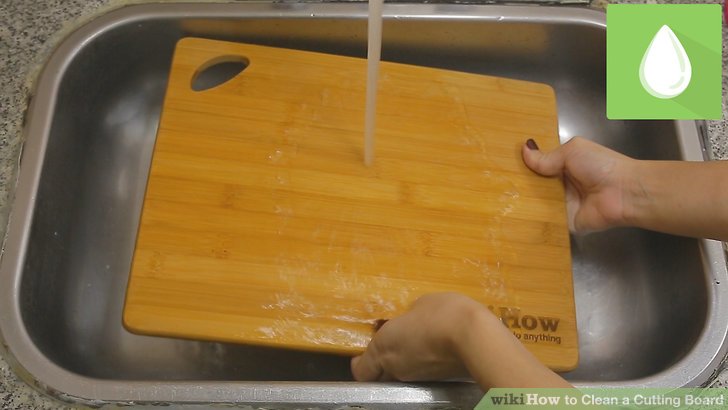
At what (x,y) coordinates should I click in order to perform the action: click on kitchen sink basin. Please return your answer as a coordinate pair (x, y). This screenshot has width=728, height=410. Looking at the image, I should click on (110, 211).